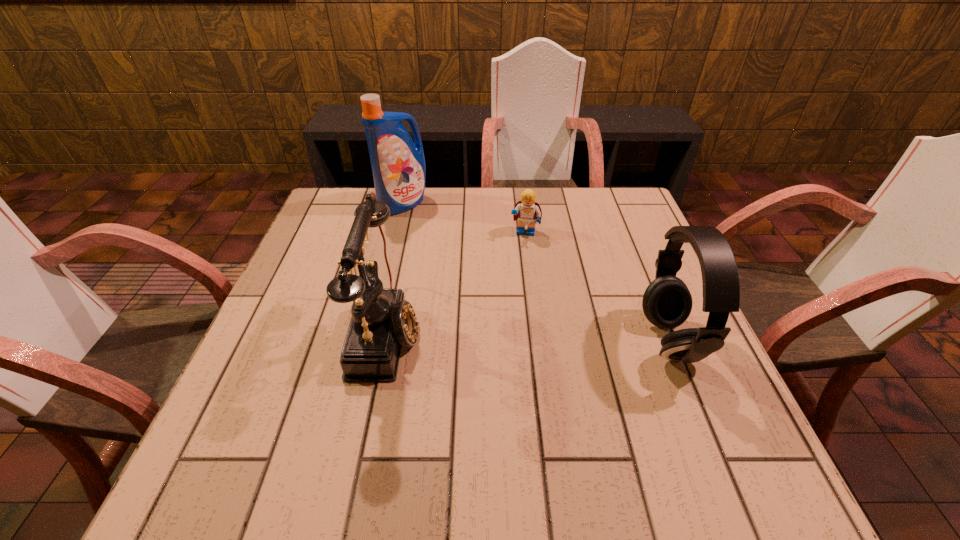
This screenshot has height=540, width=960. I want to click on free space that satisfies the following two spatial constraints: 1. on the front side of the detergent; 2. on the dial of the telephone, so click(372, 332).